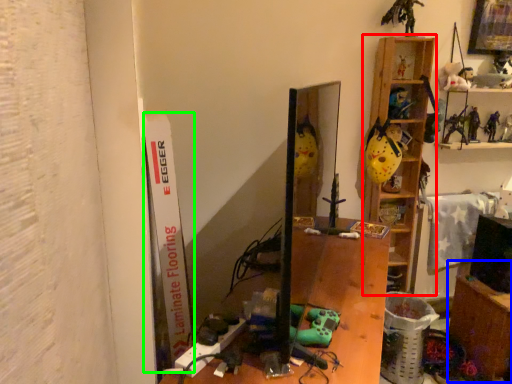
Question: Estimate the real-world distances between objects in this image. Which object is farther from shelf (highlighted by a red box), table (highlighted by a blue box) or bulletin board (highlighted by a green box)?

Choices:
 (A) table
 (B) bulletin board

Answer: (B)